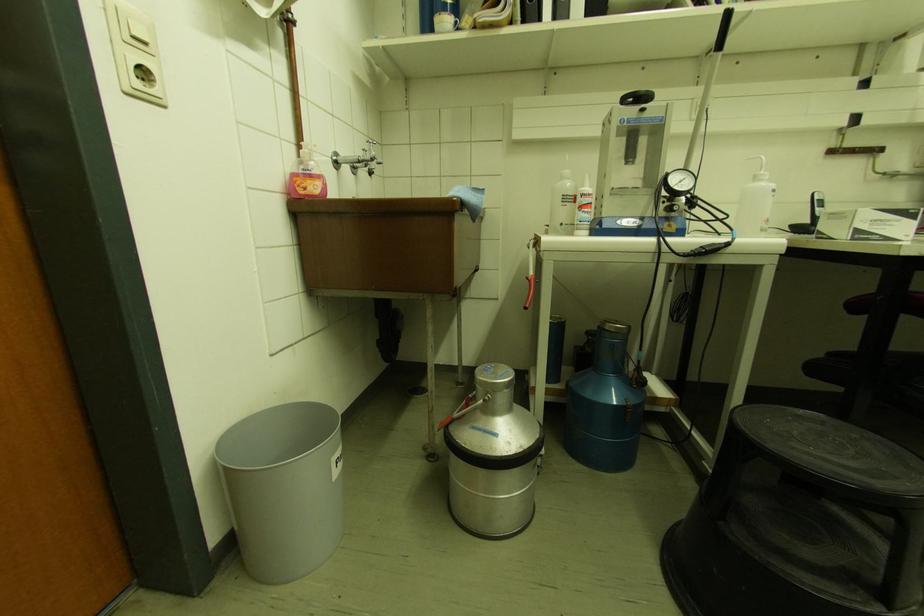
What do you see at coordinates (614, 326) in the screenshot? I see `the blue canister lid` at bounding box center [614, 326].